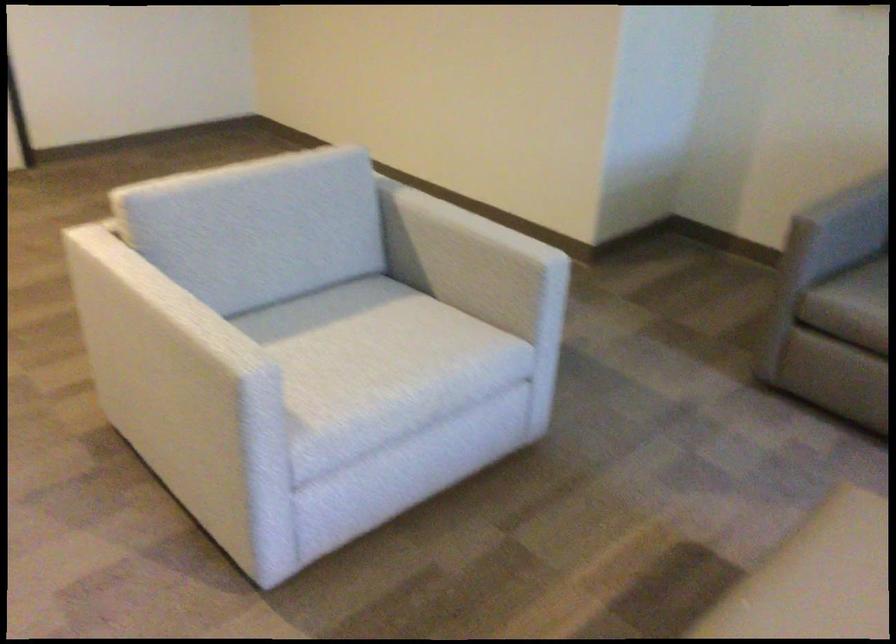
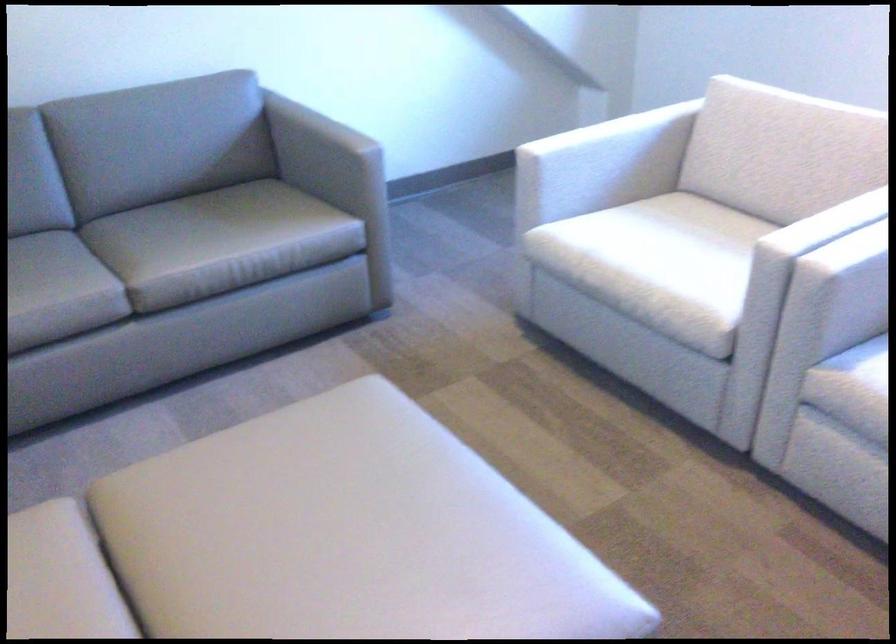
The first image is from the beginning of the video and the second image is from the end. How did the camera likely rotate when shooting the video?

The camera rotated toward right-down.